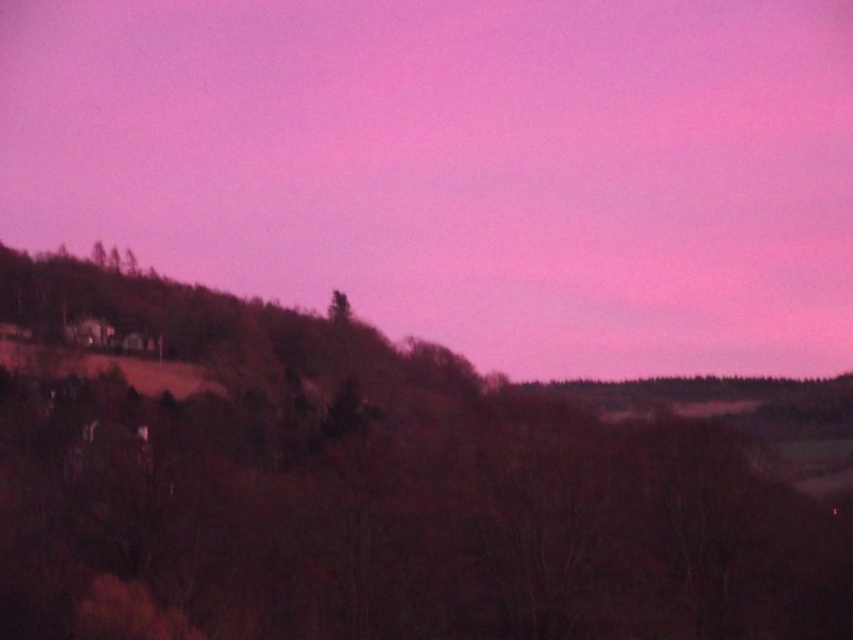
You are an artist planning to paint the scene. You want to ensure the matte pink sky at upper center and the brown matte tree at left are proportionate. Which object should you make wider in your painting to maintain accuracy?

The matte pink sky at upper center should be made wider in the painting because its width surpasses that of the brown matte tree at left according to the description.